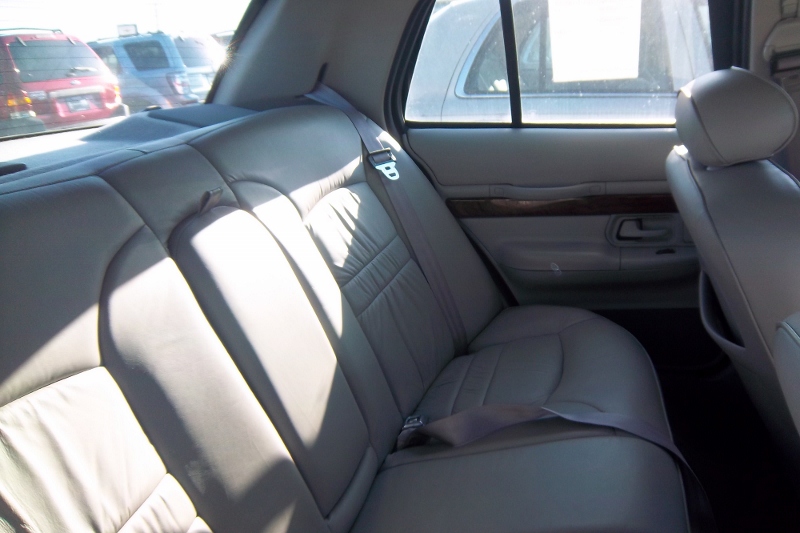
At what (x,y) coordinates should I click in order to perform the action: click on middle seat. Please return your answer as a coordinate pair (x, y). The width and height of the screenshot is (800, 533). Looking at the image, I should click on (250, 329), (218, 403), (336, 308), (454, 490).